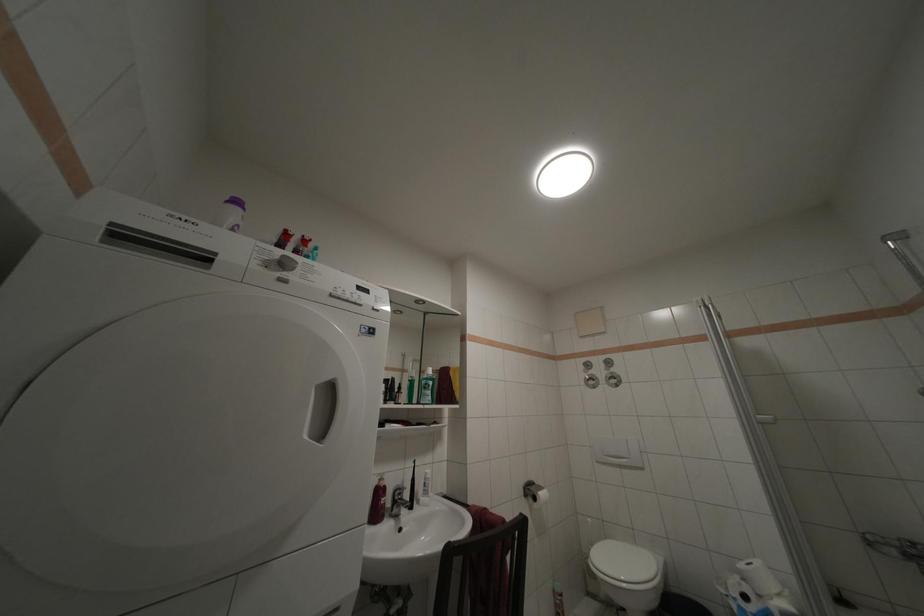
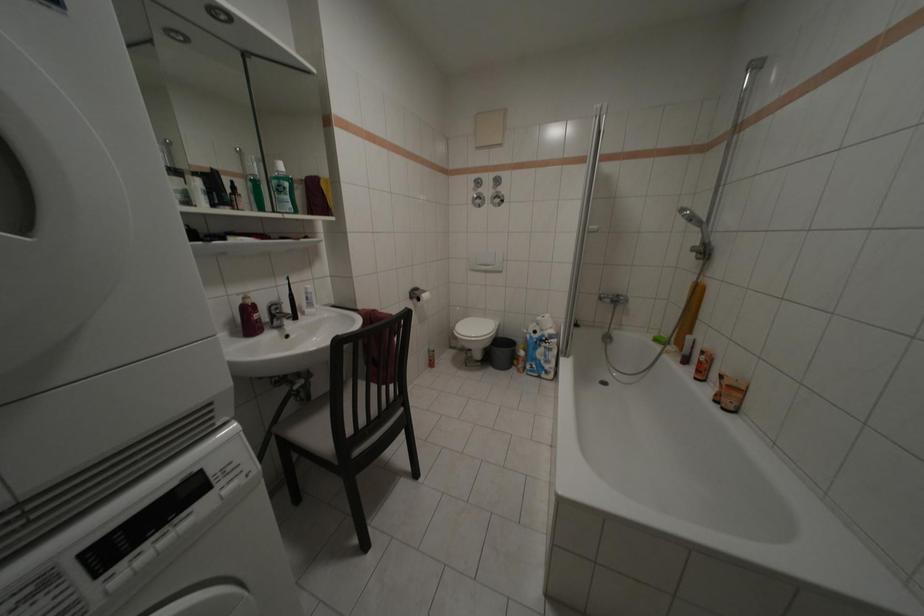
The first image is from the beginning of the video and the second image is from the end. How did the camera likely rotate when shooting the video?

The camera rotated toward right-down.